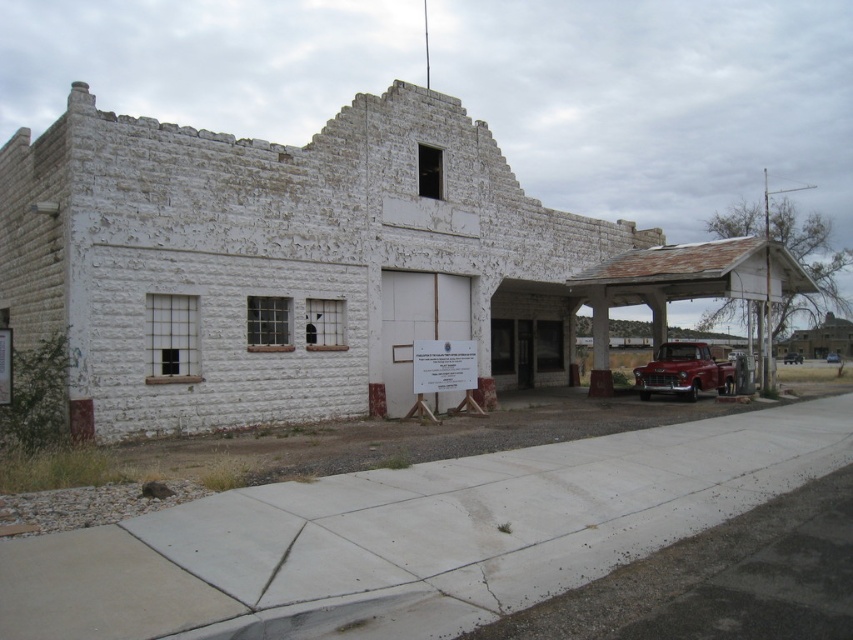
Question: Can you confirm if shiny red truck at center is positioned above metallic silver pickup truck at right?

Choices:
 (A) yes
 (B) no

Answer: (A)

Question: Observing the image, what is the correct spatial positioning of shiny red truck at center in reference to metallic silver pickup truck at right?

Choices:
 (A) left
 (B) right

Answer: (A)

Question: Which of these objects is positioned closest to the shiny red truck at center?

Choices:
 (A) metallic silver truck at right
 (B) metallic silver pickup truck at right

Answer: (B)

Question: From the image, what is the correct spatial relationship of shiny red truck at center in relation to metallic silver pickup truck at right?

Choices:
 (A) left
 (B) right

Answer: (A)

Question: Which point is closer to the camera?

Choices:
 (A) metallic silver truck at right
 (B) metallic silver pickup truck at right

Answer: (B)

Question: Which of the following is the closest to the observer?

Choices:
 (A) (683, 369)
 (B) (838, 355)
 (C) (792, 356)

Answer: (A)